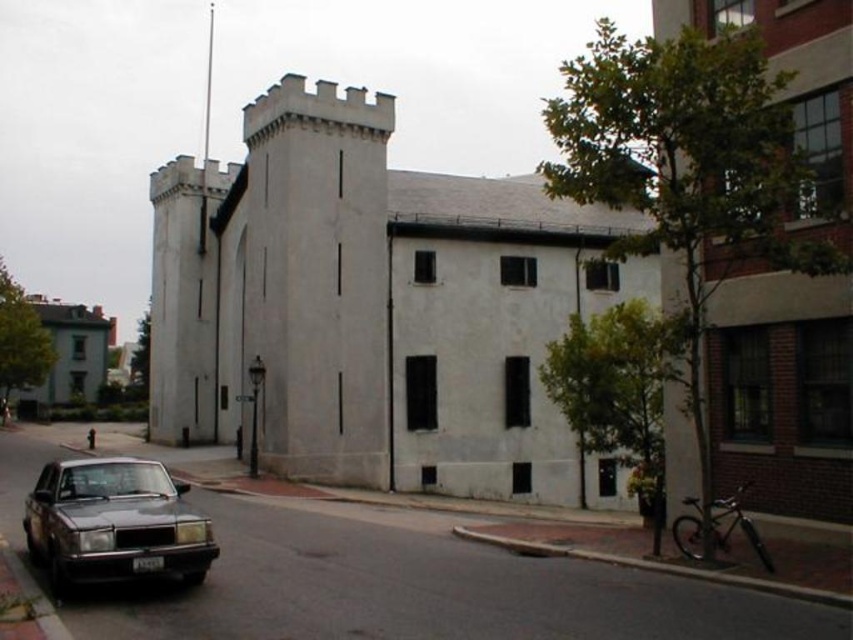
You are standing on the sidewalk in front of the white smooth stone castle at center and want to walk to the shiny dark gray sedan at lower left. Which direction should you face to walk directly towards the sedan?

You should face towards the lower left direction to walk directly towards the shiny dark gray sedan at lower left from the white smooth stone castle at center.

You are standing on the sidewalk in front of the white smooth stone castle at center and looking towards the shiny dark gray sedan at lower left. Which direction should you walk to reach the sedan?

You should walk to the left because the white smooth stone castle at center is to the right of the shiny dark gray sedan at lower left, so moving left from the castle will lead you towards the sedan.

You are standing at point (370,305) in the scene. What object is located exactly at your position?

The white smooth stone castle at center is located exactly at point (370,305).